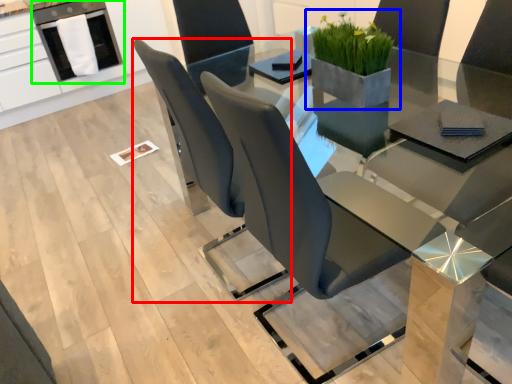
Question: Which object is the closest to the chair (highlighted by a red box)? Choose among these: houseplant (highlighted by a blue box) or dish washer (highlighted by a green box).

Choices:
 (A) houseplant
 (B) dish washer

Answer: (A)